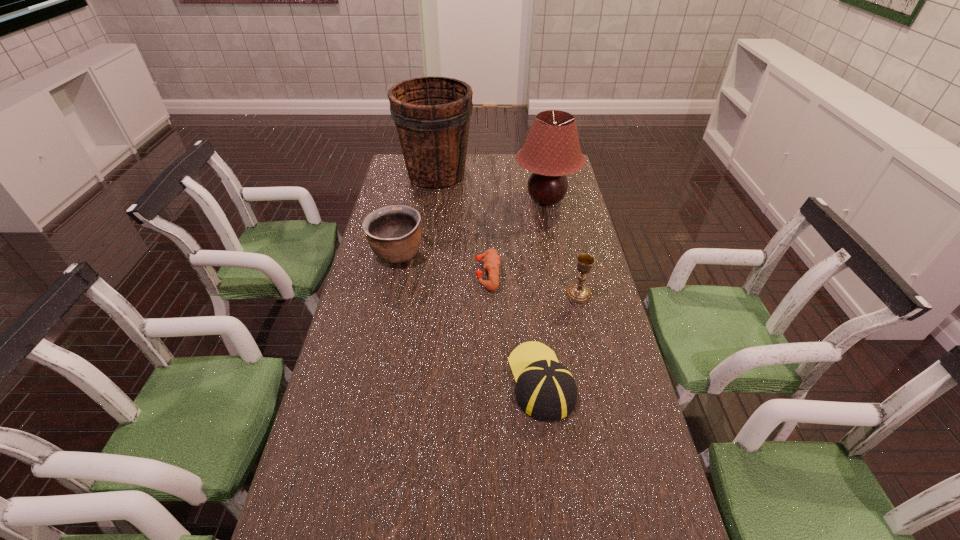
Identify the location of vacant point that satisfies the following two spatial constraints: 1. with the brim of the nearest object facing forward; 2. on the right side of the chalice. (531, 294).

I want to click on free location that satisfies the following two spatial constraints: 1. with the brim of the chalice facing forward; 2. on the left side of the nearest object, so click(x=531, y=294).

Image resolution: width=960 pixels, height=540 pixels. I want to click on vacant area in the image that satisfies the following two spatial constraints: 1. on the front-facing side of the lampshade; 2. with the gloves of the puncher facing forward, so click(561, 274).

The height and width of the screenshot is (540, 960). What are the coordinates of `blank area in the image that satisfies the following two spatial constraints: 1. with the brim of the chalice facing forward; 2. on the left side of the nearest object` in the screenshot? It's located at (531, 294).

Locate an element on the screen. The height and width of the screenshot is (540, 960). free space that satisfies the following two spatial constraints: 1. on the front-facing side of the lampshade; 2. on the right side of the chalice is located at coordinates (564, 294).

Locate an element on the screen. free space that satisfies the following two spatial constraints: 1. on the front-facing side of the lampshade; 2. on the left side of the chalice is located at coordinates (564, 294).

Where is `free location that satisfies the following two spatial constraints: 1. with the brim of the baseball cap facing forward; 2. with the gloves of the shortest object facing forward`? free location that satisfies the following two spatial constraints: 1. with the brim of the baseball cap facing forward; 2. with the gloves of the shortest object facing forward is located at coordinates (529, 274).